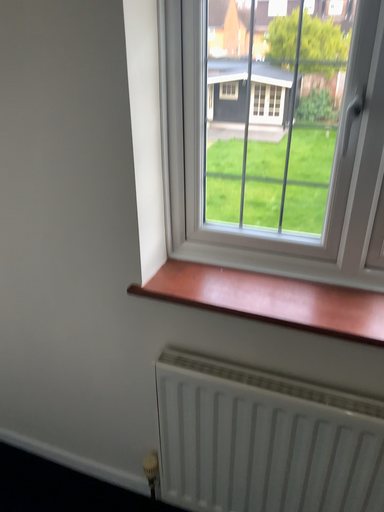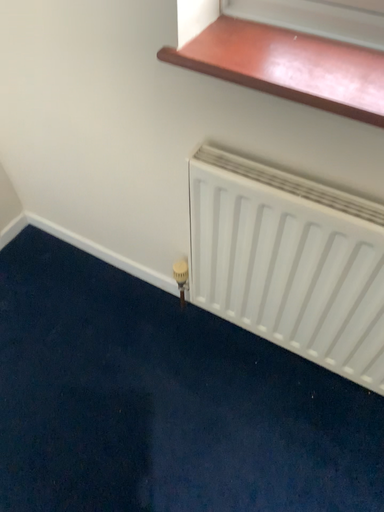
Question: Which way did the camera rotate in the video?

Choices:
 (A) rotated downward
 (B) rotated upward

Answer: (A)